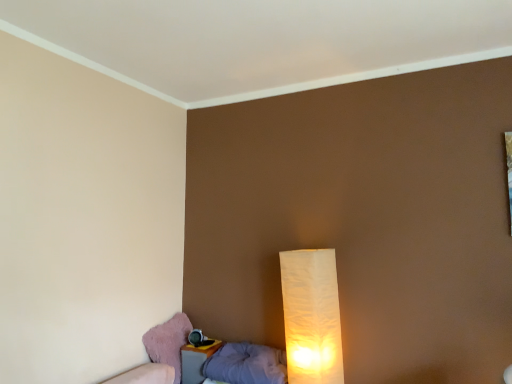
The height and width of the screenshot is (384, 512). I want to click on empty space that is ontop of matte plastic nightstand at lower left (from a real-world perspective), so click(x=199, y=343).